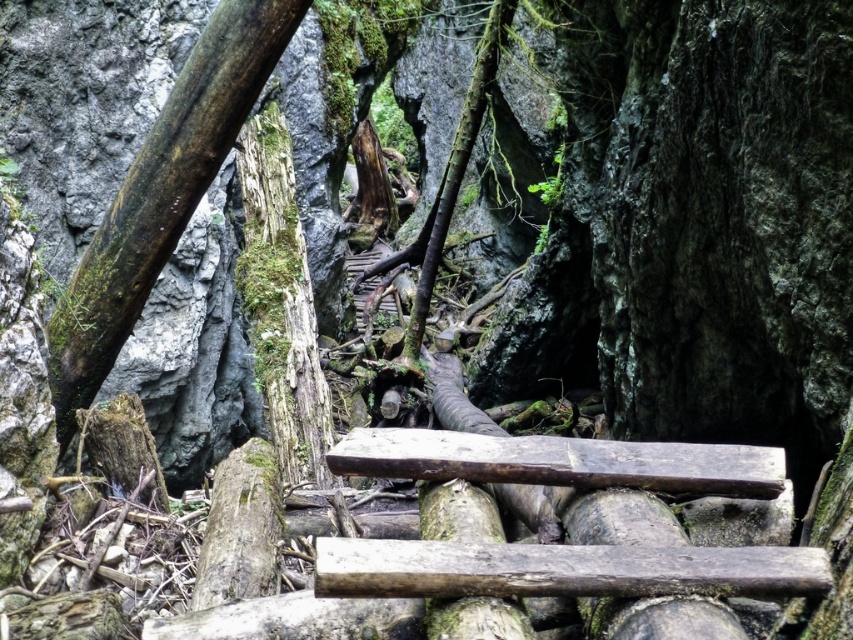
Who is higher up, dark brown wood at left or brown rough wood at center?

dark brown wood at left

Where is `dark brown wood at left`? dark brown wood at left is located at coordinates (161, 195).

Is point (758, 557) in front of point (730, 444)?

That is True.

Which is above, dark brown rough log at center or brown rough wood at center?

brown rough wood at center is above.

In order to click on dark brown rough log at center in this screenshot , I will do `click(561, 570)`.

Locate an element on the screen. The height and width of the screenshot is (640, 853). dark brown wood at left is located at coordinates tap(161, 195).

Is point (96, 256) in front of point (654, 580)?

No, it is not.

What are the coordinates of `dark brown wood at left` in the screenshot? It's located at (161, 195).

Find the location of a particular element. dark brown wood at left is located at coordinates (161, 195).